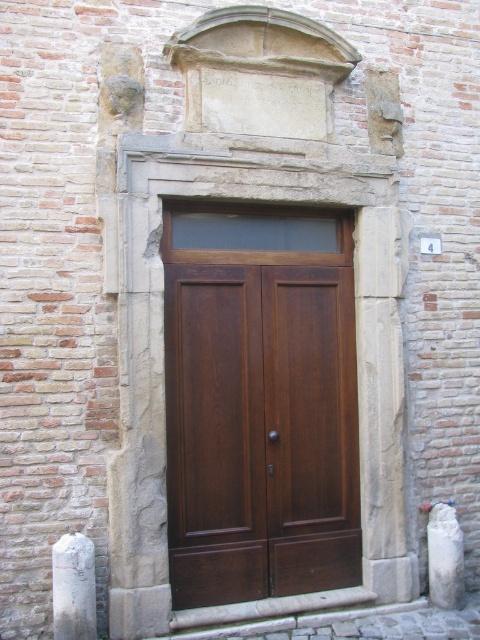
You are standing in front of the building and want to enter through the dark wood door at center. Which direction should you walk relative to the white stone pillar at lower left?

You should walk to the right of the white stone pillar at lower left to reach the dark wood door at center since the dark wood door at center is located to the right of the white stone pillar at lower left.

You are a delivery person with a cart that is 4 feet wide. You need to maneuver your cart through the space between the dark wood door at center and the white stone pillar at lower left. Based on the scene description, can your cart fit through that space?

The distance between the dark wood door at center and the white stone pillar at lower left is 3.66 feet, which is narrower than the cart width of 4 feet. Therefore, the cart cannot fit through the space between the dark wood door at center and the white stone pillar at lower left.

You are an architect designing a new building. You need to place a statue that requires a 2.5 meter tall base. Which pillar between the white stone pillar at lower left and the white marble pillar at center would be suitable as a base for the statue?

The white marble pillar at center has a greater height than the white stone pillar at lower left. Since the statue requires a 2.5 meter tall base, the white marble pillar at center is more likely to meet the height requirement and would be suitable as a base for the statue.